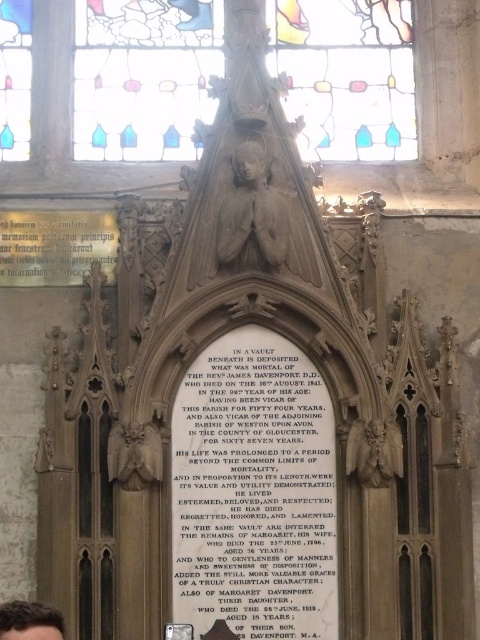
You are an interior designer planning to install a new lighting fixture. You see the stained glass window at upper center and the brown hair at lower left. Which object is located to the right of the other?

The stained glass window at upper center is positioned on the right side of brown hair at lower left, so the stained glass window at upper center is to the right of the brown hair at lower left.

You are an interior designer planning to install a new lighting fixture in the church. You need to choose between two options. The first option is a large chandelier that requires a space at least as big as the stained glass window at upper center. The second option is a smaller pendant light that needs a space at least as big as the brown hair at lower left. Based on the available space near the stone memorial plaque, which lighting fixture would be suitable?

The stained glass window at upper center is larger in size than the brown hair at lower left. Therefore, the large chandelier requiring space as big as the stained glass window at upper center would be suitable if there is enough space near the plaque. However, if the available space is only as large as the brown hair at lower left, then the smaller pendant light would be appropriate.